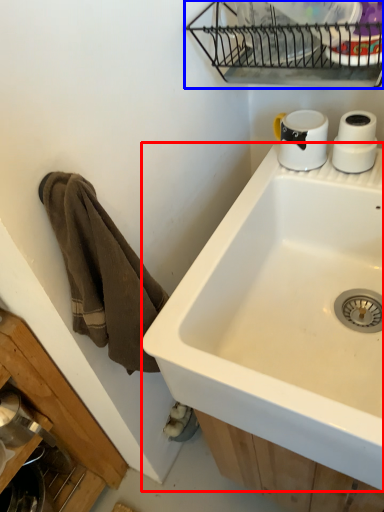
Question: Which point is closer to the camera, sink (highlighted by a red box) or appliance (highlighted by a blue box)?

Choices:
 (A) sink
 (B) appliance

Answer: (A)